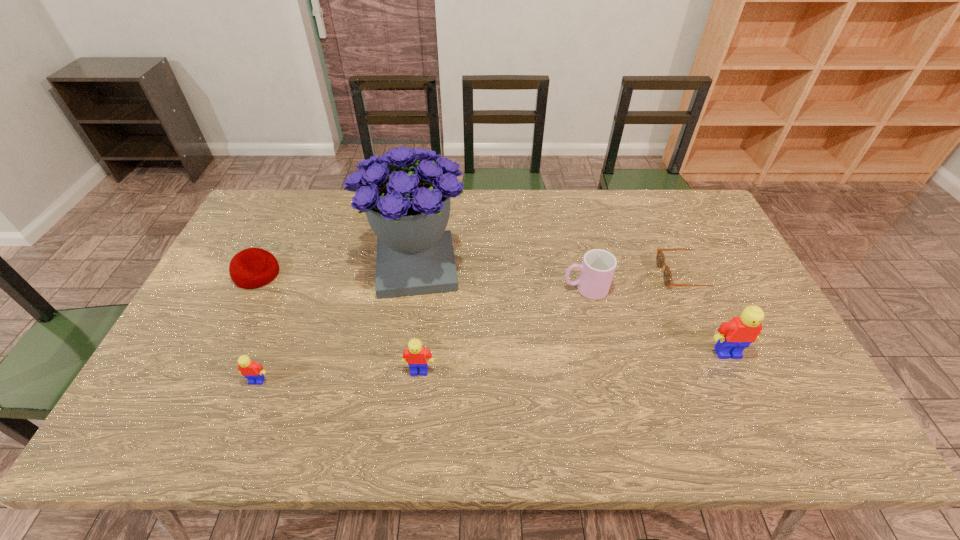
Select which object appears as the fourth closest to the bouquet. Please provide its 2D coordinates. Your answer should be formatted as a tuple, i.e. [(x, y)], where the tuple contains the x and y coordinates of a point satisfying the conditions above.

[(598, 266)]

Select which Lego is the second closest to the tallest object. Please provide its 2D coordinates. Your answer should be formatted as a tuple, i.e. [(x, y)], where the tuple contains the x and y coordinates of a point satisfying the conditions above.

[(249, 369)]

Choose which Lego is the nearest neighbor to the leftmost object. Please provide its 2D coordinates. Your answer should be formatted as a tuple, i.e. [(x, y)], where the tuple contains the x and y coordinates of a point satisfying the conditions above.

[(249, 369)]

Identify the location of free space that satisfies the following two spatial constraints: 1. on the seat area of the sixth tallest object; 2. with the handle on the side of the cup. (250, 289).